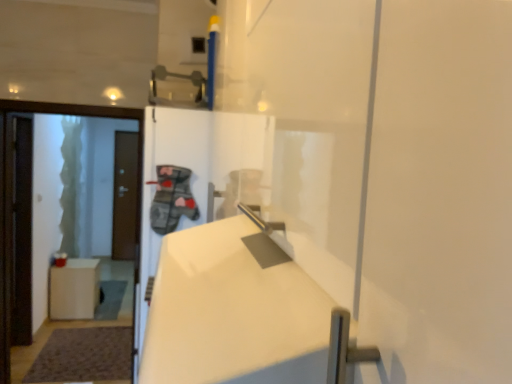
Question: Does metallic gray door handle at upper center have a greater width compared to white matte trash can at lower left?

Choices:
 (A) no
 (B) yes

Answer: (A)

Question: Can you confirm if metallic gray door handle at upper center is positioned to the right of white matte trash can at lower left?

Choices:
 (A) no
 (B) yes

Answer: (B)

Question: From a real-world perspective, is metallic gray door handle at upper center below white matte trash can at lower left?

Choices:
 (A) yes
 (B) no

Answer: (B)

Question: Is metallic gray door handle at upper center to the left of white matte trash can at lower left from the viewer's perspective?

Choices:
 (A) yes
 (B) no

Answer: (B)

Question: Is metallic gray door handle at upper center beside white matte trash can at lower left?

Choices:
 (A) yes
 (B) no

Answer: (B)

Question: From the image's perspective, is metallic gray door handle at upper center on top of white matte trash can at lower left?

Choices:
 (A) yes
 (B) no

Answer: (A)

Question: Can you see white glossy door at left, the 1th door viewed from the front, touching metallic gray door handle at upper center?

Choices:
 (A) no
 (B) yes

Answer: (A)

Question: Is white glossy door at left, marked as the first door in a right-to-left arrangement, smaller than metallic gray door handle at upper center?

Choices:
 (A) yes
 (B) no

Answer: (B)

Question: Is white glossy door at left, the 1th door viewed from the front, to the left of metallic gray door handle at upper center from the viewer's perspective?

Choices:
 (A) no
 (B) yes

Answer: (B)

Question: Is the depth of white glossy door at left, marked as the first door in a right-to-left arrangement, less than that of metallic gray door handle at upper center?

Choices:
 (A) no
 (B) yes

Answer: (A)

Question: Could metallic gray door handle at upper center be considered to be inside white glossy door at left, the 2th door positioned from the back?

Choices:
 (A) yes
 (B) no

Answer: (B)

Question: Considering the relative sizes of white glossy door at left, the 1th door viewed from the front, and metallic gray door handle at upper center in the image provided, is white glossy door at left, the 1th door viewed from the front, taller than metallic gray door handle at upper center?

Choices:
 (A) yes
 (B) no

Answer: (A)

Question: From the image's perspective, is white matte trash can at lower left over white glossy door at left, the 2th door positioned from the back?

Choices:
 (A) no
 (B) yes

Answer: (A)